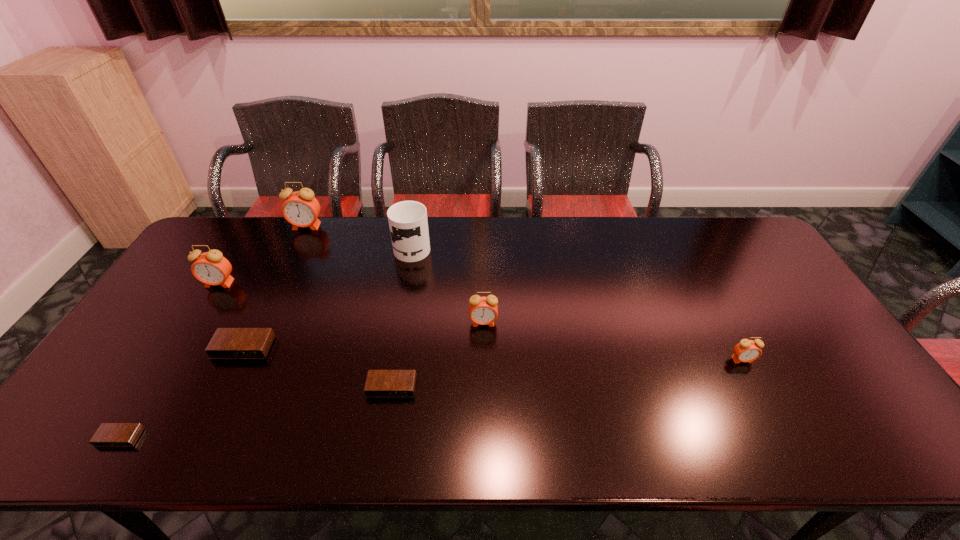
The height and width of the screenshot is (540, 960). Identify the location of vacant space located on the face of the nearest pink alarm clock. (760, 394).

What are the coordinates of `free space located on the front face of the biggest black alarm clock` in the screenshot? It's located at (211, 414).

Locate an element on the screen. This screenshot has width=960, height=540. free region located 0.090m on the front face of the seventh farthest object is located at coordinates (384, 432).

Identify the location of alarm clock situated at the far edge. (301, 209).

Locate an element on the screen. This screenshot has width=960, height=540. mug that is at the far edge is located at coordinates (408, 223).

In order to click on object situated at the near edge in this screenshot , I will do `click(108, 434)`.

What are the coordinates of `object that is at the near left corner` in the screenshot? It's located at (108, 434).

I want to click on vacant region at the far edge of the desktop, so [308, 247].

Locate an element on the screen. Image resolution: width=960 pixels, height=540 pixels. free space at the near edge is located at coordinates (464, 442).

This screenshot has width=960, height=540. In the image, there is a desktop. In order to click on free region at the right edge in this screenshot , I will do `click(767, 306)`.